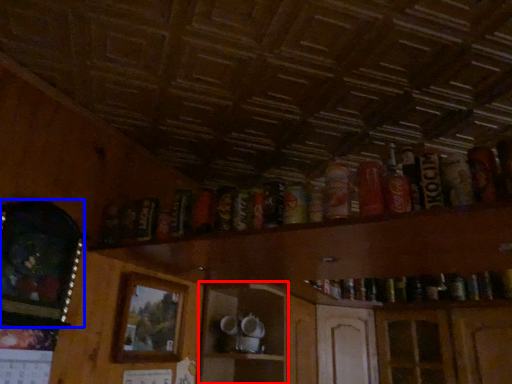
Question: Among these objects, which one is farthest to the camera, shelf (highlighted by a red box) or picture frame (highlighted by a blue box)?

Choices:
 (A) shelf
 (B) picture frame

Answer: (A)